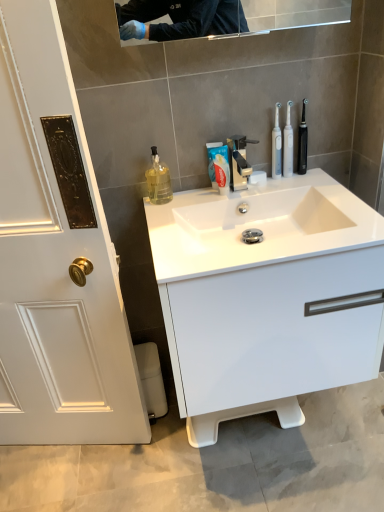
You are a GUI agent. You are given a task and a screenshot of the screen. Output one action in this format:
    pyautogui.click(x=<x>, y=<y>)
    Task: Click on the empty space that is to the right of white glossy toothpaste at center
    This screenshot has height=512, width=384.
    Given the screenshot: What is the action you would take?
    pyautogui.click(x=279, y=187)